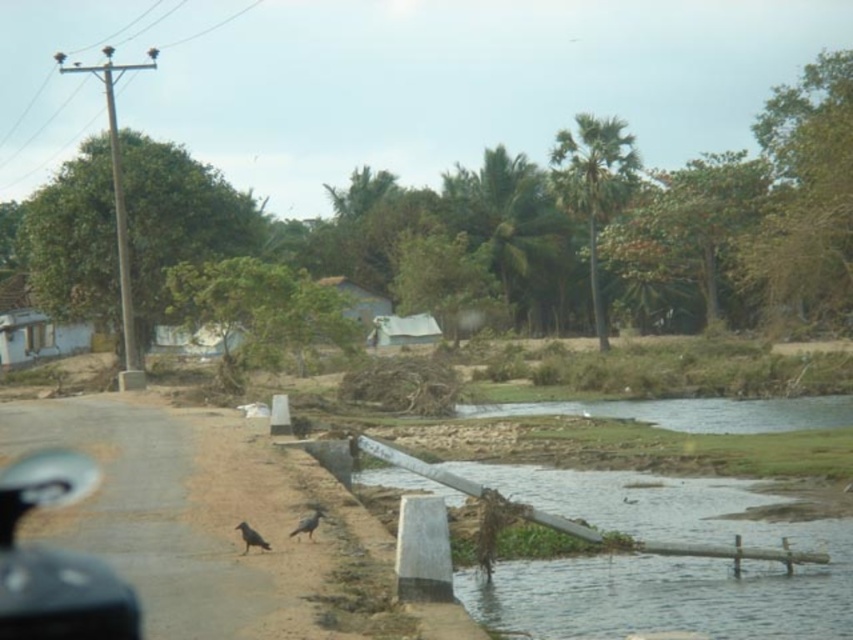
Question: Which object is positioned farthest from the black rubber handlebar at lower left?

Choices:
 (A) gray matte bird at lower center
 (B) dark gray feathered bird at lower left

Answer: (A)

Question: Is gray matte bird at lower center thinner than dark gray feathered bird at lower left?

Choices:
 (A) yes
 (B) no

Answer: (B)

Question: Does gray matte bird at lower center have a smaller size compared to dark gray feathered bird at lower left?

Choices:
 (A) no
 (B) yes

Answer: (A)

Question: Can you confirm if black rubber handlebar at lower left is smaller than dark gray feathered bird at lower left?

Choices:
 (A) yes
 (B) no

Answer: (B)

Question: Estimate the real-world distances between objects in this image. Which object is closer to the gray matte bird at lower center?

Choices:
 (A) black rubber handlebar at lower left
 (B) dark gray feathered bird at lower left

Answer: (B)

Question: Which point is closer to the camera taking this photo?

Choices:
 (A) (312, 513)
 (B) (38, 605)

Answer: (B)